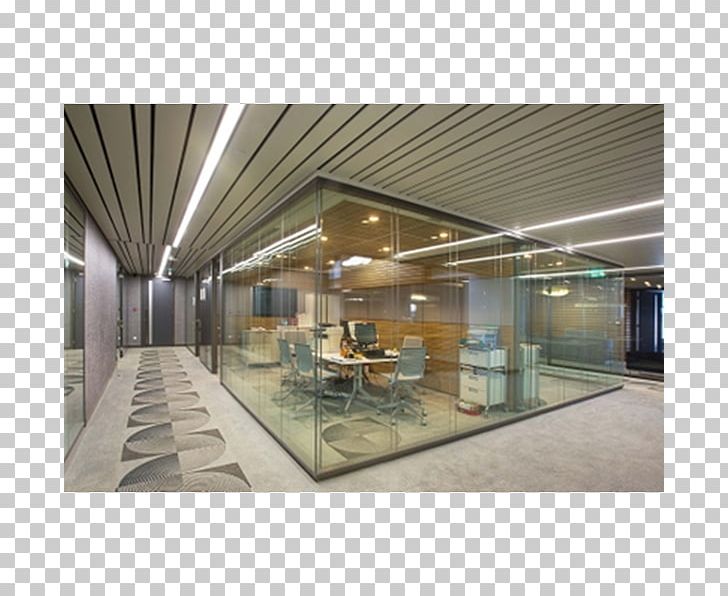
The width and height of the screenshot is (728, 596). Identify the location of office. (341, 424), (440, 399), (574, 365), (256, 342).